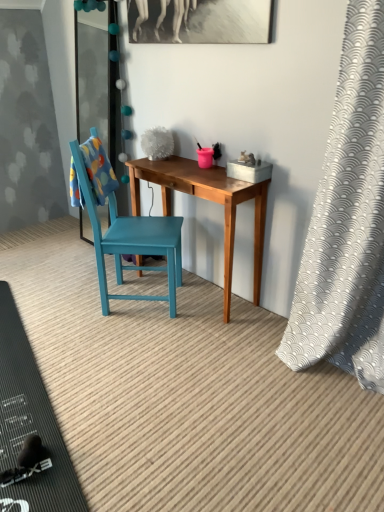
This screenshot has width=384, height=512. I want to click on vacant region below wooden desk at center (from a real-world perspective), so (203, 293).